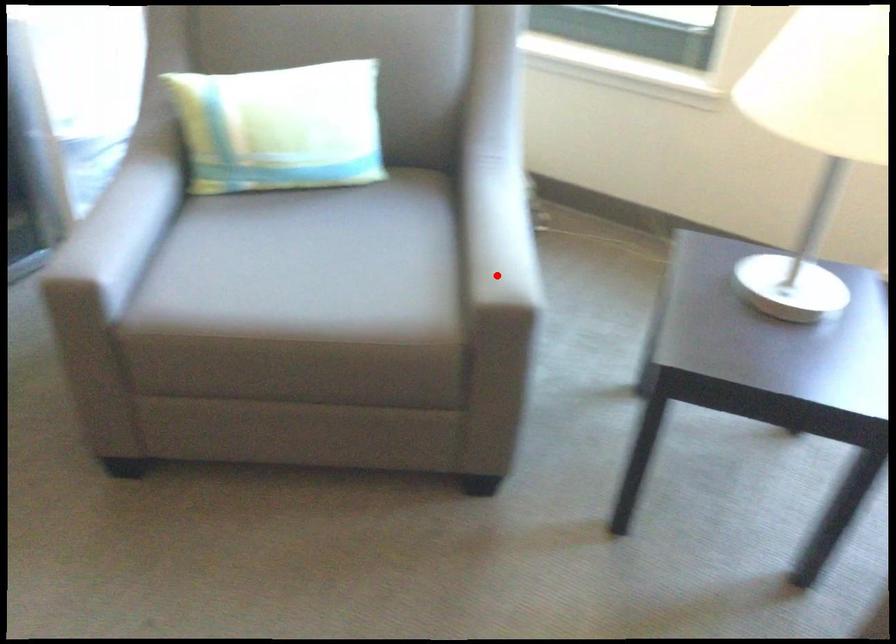
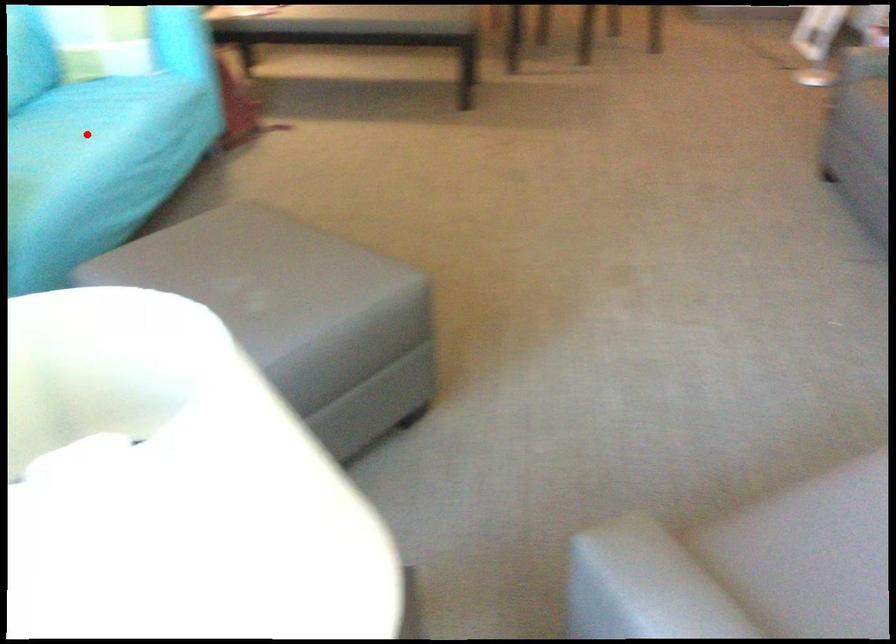
I am providing you with two images of the same scene from different viewpoints. A red point is marked on the first image and another point is marked on the second image. Does the point marked in image1 correspond to the same location as the one in image2?

No